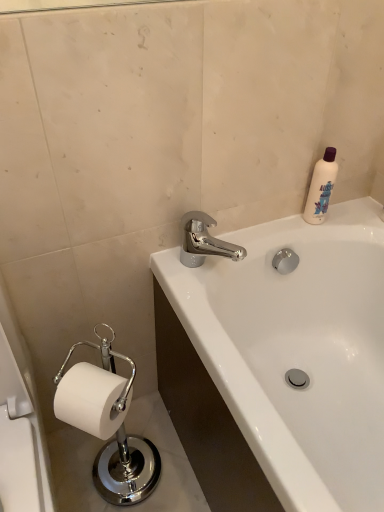
At what (x,y) coordinates should I click in order to perform the action: click on white glossy bathtub at upper right. Please return your answer as a coordinate pair (x, y). The width and height of the screenshot is (384, 512). Looking at the image, I should click on (297, 350).

Describe the element at coordinates (20, 424) in the screenshot. I see `white paper at lower left` at that location.

You are a GUI agent. You are given a task and a screenshot of the screen. Output one action in this format:
    pyautogui.click(x=<x>, y=<y>)
    Task: Click on the white glossy bathtub at upper right
    This screenshot has height=512, width=384.
    Given the screenshot: What is the action you would take?
    pyautogui.click(x=297, y=350)

Is chrome metallic faucet at upper center at the back of white plastic bottle at upper right?

No, white plastic bottle at upper right's orientation is not away from chrome metallic faucet at upper center.

From the image's perspective, which is below, white plastic bottle at upper right or chrome metallic faucet at upper center?

chrome metallic faucet at upper center, from the image's perspective.

Is white plastic bottle at upper right not within chrome metallic faucet at upper center?

Absolutely, white plastic bottle at upper right is external to chrome metallic faucet at upper center.

Is white plastic bottle at upper right wider or thinner than chrome metallic faucet at upper center?

Considering their sizes, white plastic bottle at upper right looks slimmer than chrome metallic faucet at upper center.

Is white plastic bottle at upper right further to the viewer compared to white glossy bathtub at upper right?

Yes, it is behind white glossy bathtub at upper right.

Can you confirm if white plastic bottle at upper right is smaller than white glossy bathtub at upper right?

Correct, white plastic bottle at upper right occupies less space than white glossy bathtub at upper right.

From the image's perspective, which object appears higher, white plastic bottle at upper right or white glossy bathtub at upper right?

white plastic bottle at upper right, from the image's perspective.

Can you confirm if white plastic bottle at upper right is taller than white glossy bathtub at upper right?

Incorrect, the height of white plastic bottle at upper right is not larger of that of white glossy bathtub at upper right.

Is white paper at lower left taller than chrome metallic faucet at upper center?

Yes.

Is white paper at lower left closer to the viewer compared to chrome metallic faucet at upper center?

Yes, it is.

Could you tell me if white paper at lower left is turned towards chrome metallic faucet at upper center?

No.

Is the surface of white paper at lower left in direct contact with chrome metallic faucet at upper center?

There is a gap between white paper at lower left and chrome metallic faucet at upper center.

Could you tell me if white paper at lower left is turned towards white plastic bottle at upper right?

No, white paper at lower left is not oriented towards white plastic bottle at upper right.

Can you confirm if white paper at lower left is smaller than white plastic bottle at upper right?

No.

Is the surface of white paper at lower left in direct contact with white plastic bottle at upper right?

No, white paper at lower left is not in contact with white plastic bottle at upper right.

From the image's perspective, is chrome metallic faucet at upper center above or below white plastic bottle at upper right?

From the image's perspective, chrome metallic faucet at upper center appears below white plastic bottle at upper right.

Is chrome metallic faucet at upper center inside or outside of white plastic bottle at upper right?

chrome metallic faucet at upper center is located beyond the bounds of white plastic bottle at upper right.

Is chrome metallic faucet at upper center bigger or smaller than white plastic bottle at upper right?

Considering their sizes, chrome metallic faucet at upper center takes up more space than white plastic bottle at upper right.

How far apart are white glossy bathtub at upper right and white plastic bottle at upper right?

white glossy bathtub at upper right and white plastic bottle at upper right are 33.53 centimeters apart.

Consider the image. From the image's perspective, which is above, white glossy bathtub at upper right or white plastic bottle at upper right?

white plastic bottle at upper right is shown above in the image.

Is white glossy bathtub at upper right outside of white plastic bottle at upper right?

Indeed, white glossy bathtub at upper right is completely outside white plastic bottle at upper right.

Which of these two, white glossy bathtub at upper right or white plastic bottle at upper right, stands shorter?

white plastic bottle at upper right.

Is point (183, 249) closer to camera compared to point (19, 405)?

No, it is behind (19, 405).

Locate an element on the screen. This screenshot has height=512, width=384. tap above the white paper at lower left (from a real-world perspective) is located at coordinates (203, 241).

Relative to white paper at lower left, is chrome metallic faucet at upper center in front or behind?

chrome metallic faucet at upper center is behind white paper at lower left.

Locate an element on the screen. cleaning product on the right of chrome metallic faucet at upper center is located at coordinates tap(321, 188).

The image size is (384, 512). Find the location of `bathtub lying in front of the white plastic bottle at upper right`. bathtub lying in front of the white plastic bottle at upper right is located at coordinates (297, 350).

Looking at the image, which one is located closer to white glossy bathtub at upper right, white paper at lower left or white plastic bottle at upper right?

Based on the image, white plastic bottle at upper right appears to be nearer to white glossy bathtub at upper right.

Looking at the image, which one is located closer to chrome metallic faucet at upper center, white plastic bottle at upper right or white paper at lower left?

white plastic bottle at upper right lies closer to chrome metallic faucet at upper center than the other object.

Based on their spatial positions, is white glossy bathtub at upper right or white plastic bottle at upper right closer to chrome metallic faucet at upper center?

white plastic bottle at upper right is positioned closer to the anchor chrome metallic faucet at upper center.

Looking at this image, based on their spatial positions, is white plastic bottle at upper right or chrome metallic faucet at upper center closer to white paper at lower left?

The object closer to white paper at lower left is chrome metallic faucet at upper center.

When comparing their distances from white paper at lower left, does white plastic bottle at upper right or white glossy bathtub at upper right seem closer?

white glossy bathtub at upper right lies closer to white paper at lower left than the other object.

Considering their positions, is white glossy bathtub at upper right positioned closer to white paper at lower left than white plastic bottle at upper right?

white glossy bathtub at upper right is closer to white paper at lower left.

Estimate the real-world distances between objects in this image. Which object is closer to white plastic bottle at upper right, chrome metallic faucet at upper center or white glossy bathtub at upper right?

Based on the image, chrome metallic faucet at upper center appears to be nearer to white plastic bottle at upper right.

Which object lies further to the anchor point chrome metallic faucet at upper center, white plastic bottle at upper right or white glossy bathtub at upper right?

white glossy bathtub at upper right.

Find the location of a particular element. This screenshot has height=512, width=384. tap located between white paper at lower left and white plastic bottle at upper right in the depth direction is located at coordinates point(203,241).

At what (x,y) coordinates should I click in order to perform the action: click on tap that lies between white plastic bottle at upper right and white glossy bathtub at upper right from top to bottom. Please return your answer as a coordinate pair (x, y). The height and width of the screenshot is (512, 384). Looking at the image, I should click on (203, 241).

Where is `tap between white paper at lower left and white glossy bathtub at upper right in the horizontal direction`? Image resolution: width=384 pixels, height=512 pixels. tap between white paper at lower left and white glossy bathtub at upper right in the horizontal direction is located at coordinates (203, 241).

Identify the location of bathtub situated between white paper at lower left and white plastic bottle at upper right from left to right. The height and width of the screenshot is (512, 384). (297, 350).